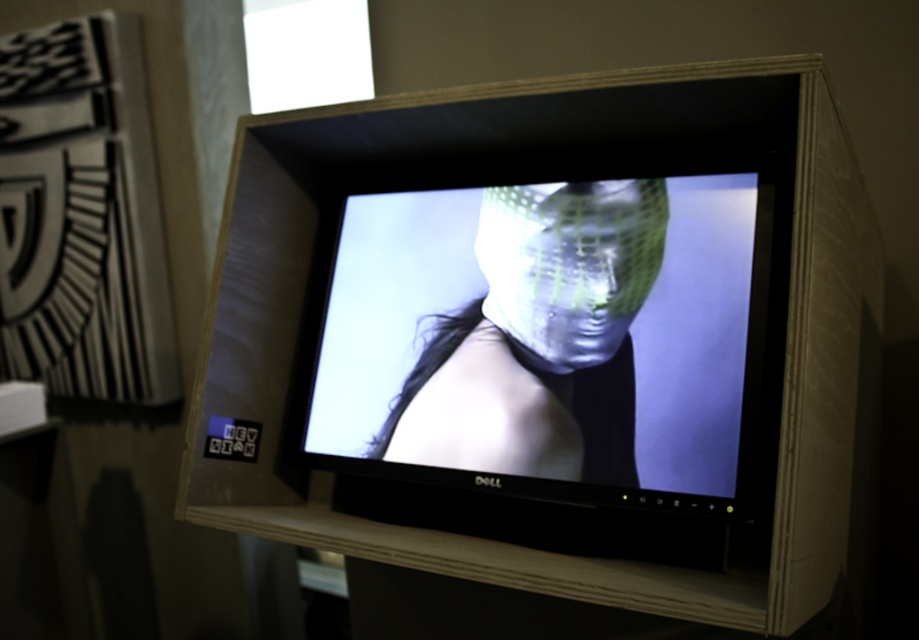
Is metallic mesh mask at center above translucent plastic mask at center?

Actually, metallic mesh mask at center is below translucent plastic mask at center.

Who is more distant from viewer, [528,381] or [614,230]?

Positioned behind is point [528,381].

The height and width of the screenshot is (640, 919). Identify the location of metallic mesh mask at center. (539, 339).